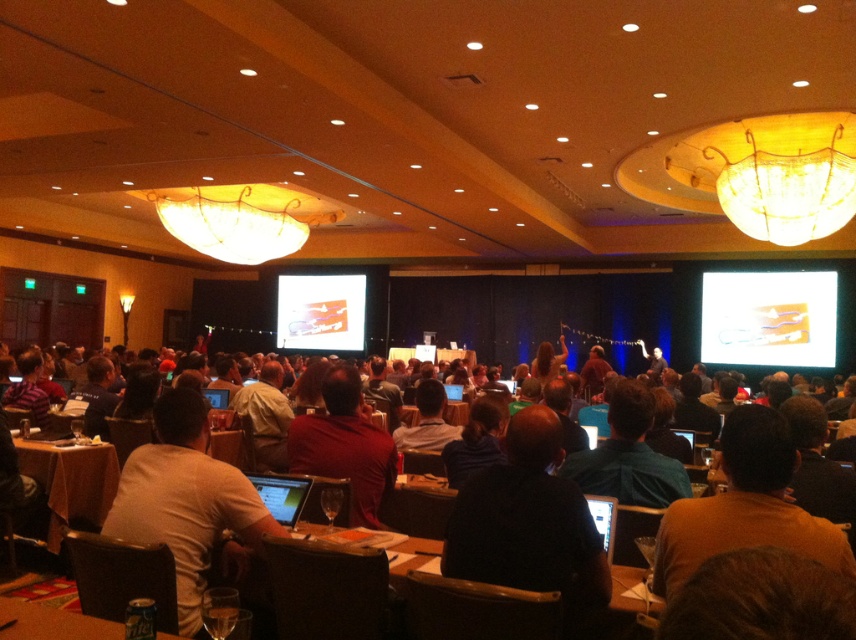
The image size is (856, 640). What do you see at coordinates (187, 502) in the screenshot?
I see `white matte shirt at center` at bounding box center [187, 502].

Which is in front, point (260, 508) or point (806, 324)?

Point (260, 508)

The image size is (856, 640). What are the coordinates of `white matte shirt at center` in the screenshot? It's located at (187, 502).

Does matte orange projector screen at center have a lesser width compared to metallic silver can at lower left?

In fact, matte orange projector screen at center might be wider than metallic silver can at lower left.

What are the coordinates of `matte orange projector screen at center` in the screenshot? It's located at (321, 310).

Does dark brown leather jacket at center have a smaller size compared to matte plastic projector screen at upper right?

Indeed, dark brown leather jacket at center has a smaller size compared to matte plastic projector screen at upper right.

Is dark brown leather jacket at center bigger than matte plastic projector screen at upper right?

Incorrect, dark brown leather jacket at center is not larger than matte plastic projector screen at upper right.

Which is in front, point (490, 500) or point (709, 360)?

Point (490, 500) is more forward.

Locate an element on the screen. The image size is (856, 640). dark brown leather jacket at center is located at coordinates (528, 522).